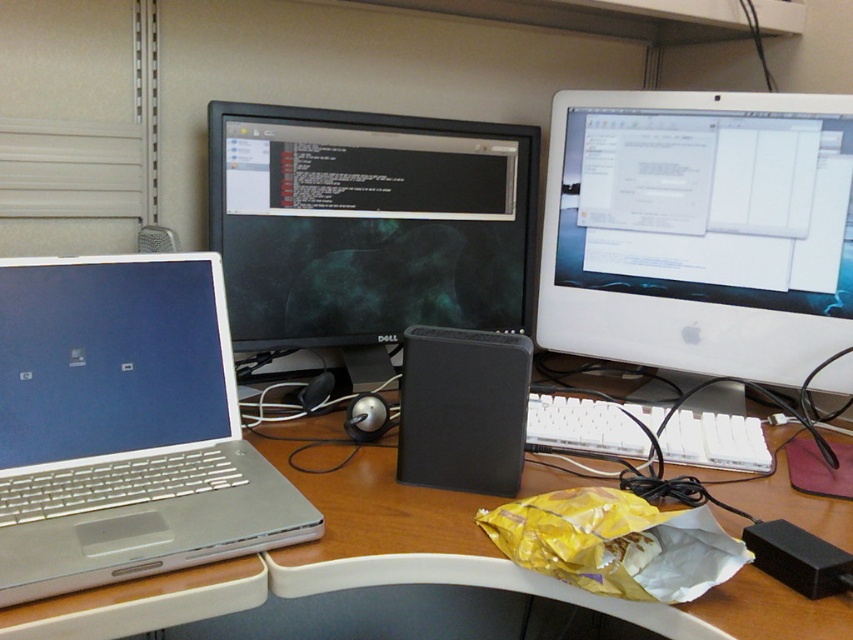
Is point (221, 289) positioned in front of point (157, 618)?

No, (221, 289) is further to viewer.

Is point (218, 518) farther from viewer compared to point (329, 477)?

No, it is not.

The width and height of the screenshot is (853, 640). What do you see at coordinates (125, 428) in the screenshot?
I see `silver metallic laptop at left` at bounding box center [125, 428].

The height and width of the screenshot is (640, 853). In order to click on silver metallic laptop at left in this screenshot , I will do `click(125, 428)`.

Can you confirm if white glossy monitor at upper right is shorter than silver metallic laptop at left?

In fact, white glossy monitor at upper right may be taller than silver metallic laptop at left.

Who is taller, white glossy monitor at upper right or silver metallic laptop at left?

With more height is white glossy monitor at upper right.

Describe the element at coordinates (699, 230) in the screenshot. Image resolution: width=853 pixels, height=640 pixels. I see `white glossy monitor at upper right` at that location.

In order to click on white glossy monitor at upper right in this screenshot , I will do `click(699, 230)`.

You are a GUI agent. You are given a task and a screenshot of the screen. Output one action in this format:
    pyautogui.click(x=<x>, y=<y>)
    Task: Click on the silver metallic laptop at left
    The image size is (853, 640).
    Given the screenshot: What is the action you would take?
    pyautogui.click(x=125, y=428)

Between point (28, 449) and point (520, 465), which one is positioned in front?

Point (28, 449) is in front.

What are the coordinates of `silver metallic laptop at left` in the screenshot? It's located at (125, 428).